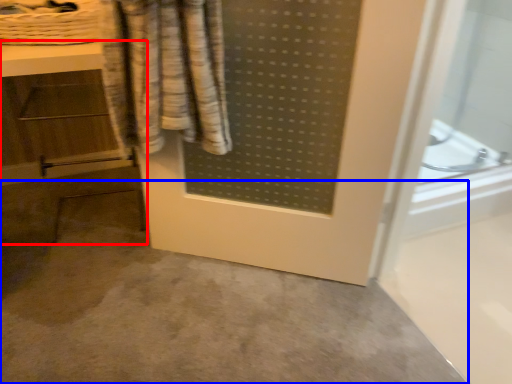
Question: Which object is further to the camera taking this photo, vanity (highlighted by a red box) or concrete (highlighted by a blue box)?

Choices:
 (A) vanity
 (B) concrete

Answer: (A)